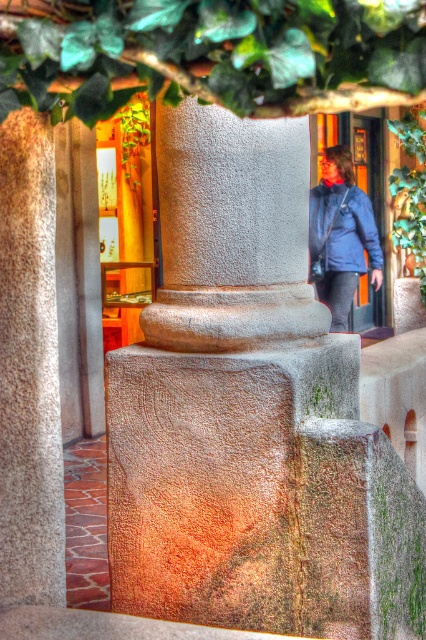
Does green leafy tree at upper center have a larger size compared to blue matte jacket at upper right?

No.

Can you confirm if green leafy tree at upper center is shorter than blue matte jacket at upper right?

Indeed, green leafy tree at upper center has a lesser height compared to blue matte jacket at upper right.

Which is in front, point (351, 106) or point (374, 234)?

Point (351, 106) is in front.

You are a GUI agent. You are given a task and a screenshot of the screen. Output one action in this format:
    pyautogui.click(x=<x>, y=<y>)
    Task: Click on the green leafy tree at upper center
    
    Given the screenshot: What is the action you would take?
    pyautogui.click(x=212, y=54)